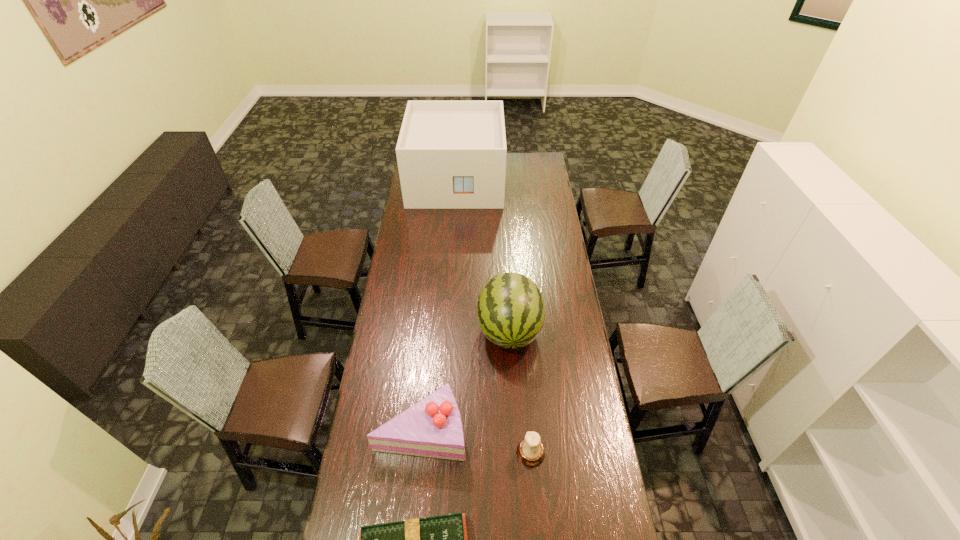
I want to click on object that ranks as the third closest to the shortest object, so click(511, 312).

Select which object is the third closest to the candle holder. Please provide its 2D coordinates. Your answer should be formatted as a tuple, i.e. [(x, y)], where the tuple contains the x and y coordinates of a point satisfying the conditions above.

[(511, 312)]

Identify the location of vacant region that satisfies the following two spatial constraints: 1. at the stem end of the candle holder; 2. on the left side of the watermelon. (516, 453).

In order to click on free location that satisfies the following two spatial constraints: 1. on the front side of the fourth tallest object; 2. on the left side of the third shortest object in this screenshot , I will do `click(419, 453)`.